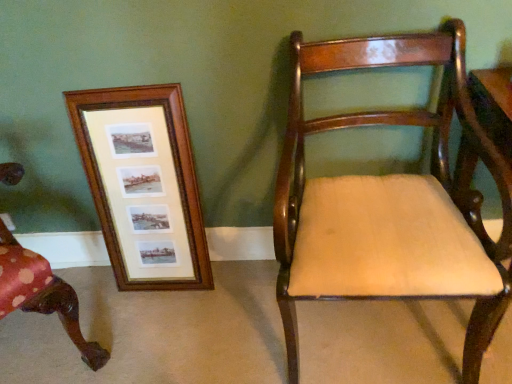
Question: Are mahogany wood chair at right, which is the 2th chair from left to right, and wooden chair at left, which is counted as the second chair, starting from the right, making contact?

Choices:
 (A) no
 (B) yes

Answer: (A)

Question: Considering the relative positions of mahogany wood chair at right, which is the 2th chair from left to right, and wooden chair at left, marked as the first chair in a left-to-right arrangement, in the image provided, is mahogany wood chair at right, which is the 2th chair from left to right, to the right of wooden chair at left, marked as the first chair in a left-to-right arrangement, from the viewer's perspective?

Choices:
 (A) no
 (B) yes

Answer: (B)

Question: Is the depth of mahogany wood chair at right, the 1th chair viewed from the right, less than that of wooden chair at left, marked as the first chair in a left-to-right arrangement?

Choices:
 (A) no
 (B) yes

Answer: (B)

Question: Does mahogany wood chair at right, the 1th chair viewed from the right, appear on the left side of wooden chair at left, which is counted as the second chair, starting from the right?

Choices:
 (A) no
 (B) yes

Answer: (A)

Question: From the image's perspective, is mahogany wood chair at right, the 1th chair viewed from the right, over wooden chair at left, which is counted as the second chair, starting from the right?

Choices:
 (A) no
 (B) yes

Answer: (B)

Question: Is wooden chair at left, marked as the first chair in a left-to-right arrangement, a part of mahogany wood chair at right, the 1th chair viewed from the right?

Choices:
 (A) no
 (B) yes

Answer: (A)

Question: Can you confirm if wooden chair at left, marked as the first chair in a left-to-right arrangement, is positioned to the left of wooden frame at left?

Choices:
 (A) yes
 (B) no

Answer: (A)

Question: Is wooden chair at left, which is counted as the second chair, starting from the right, wider than wooden frame at left?

Choices:
 (A) yes
 (B) no

Answer: (A)

Question: From a real-world perspective, is wooden chair at left, marked as the first chair in a left-to-right arrangement, located higher than wooden frame at left?

Choices:
 (A) no
 (B) yes

Answer: (B)

Question: Can you confirm if wooden chair at left, marked as the first chair in a left-to-right arrangement, is smaller than wooden frame at left?

Choices:
 (A) yes
 (B) no

Answer: (B)

Question: Does wooden chair at left, which is counted as the second chair, starting from the right, lie behind wooden frame at left?

Choices:
 (A) no
 (B) yes

Answer: (A)

Question: Is wooden chair at left, which is counted as the second chair, starting from the right, shorter than wooden frame at left?

Choices:
 (A) yes
 (B) no

Answer: (B)

Question: Is wooden frame at left taller than mahogany wood chair at right, the 1th chair viewed from the right?

Choices:
 (A) no
 (B) yes

Answer: (A)